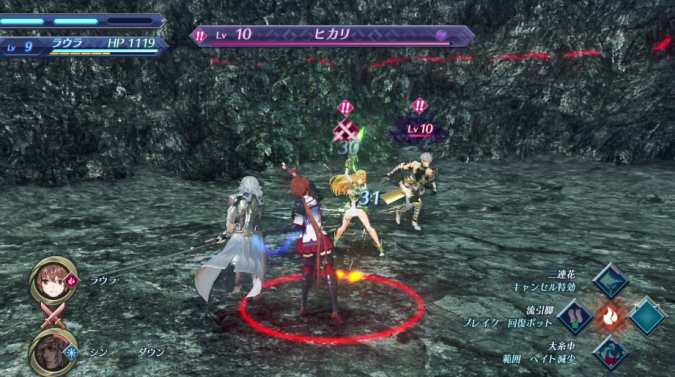
You are a GUI agent. You are given a task and a screenshot of the screen. Output one action in this format:
    pyautogui.click(x=<x>, y=<y>)
    Task: Click on the floor
    The image size is (675, 377).
    Given the screenshot: What is the action you would take?
    pyautogui.click(x=472, y=249)